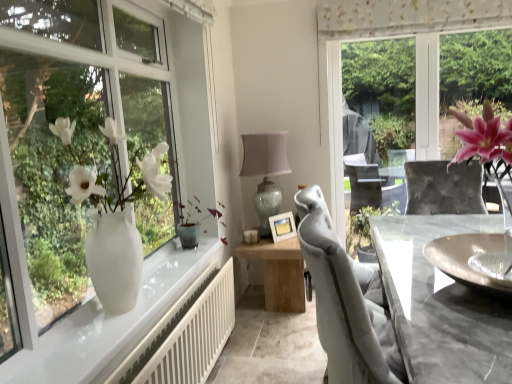
Question: Based on their positions, is pink flower vase at right located to the left or right of wooden table at center?

Choices:
 (A) right
 (B) left

Answer: (A)

Question: Is pink flower vase at right in front of or behind wooden table at center in the image?

Choices:
 (A) behind
 (B) front

Answer: (A)

Question: Which is farther from the green matte plant at center?

Choices:
 (A) wooden table at center
 (B) pink flower vase at right
 (C) matte glass table lamp at center
 (D) sheer floral-patterned curtain at upper center
 (E) white matte radiator at lower left

Answer: (D)

Question: Which is farther from the pink flower vase at right?

Choices:
 (A) white matte radiator at lower left
 (B) sheer floral-patterned curtain at upper center
 (C) green matte plant at center
 (D) matte glass table lamp at center
 (E) wooden table at center

Answer: (A)